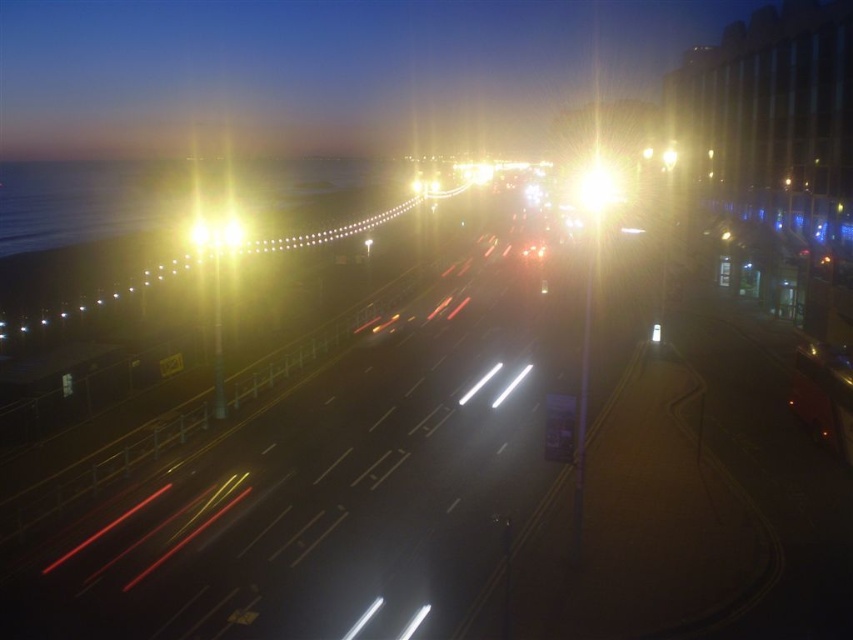
Is metallic orange car at lower right taller than bright yellow light at center?

No, metallic orange car at lower right is not taller than bright yellow light at center.

Is metallic orange car at lower right in front of bright yellow light at center?

That is True.

I want to click on metallic orange car at lower right, so click(x=822, y=394).

Does bright metallic streetlight at center have a lesser height compared to bright yellow light at center?

No, bright metallic streetlight at center is not shorter than bright yellow light at center.

Identify the location of bright metallic streetlight at center. point(596,186).

Is point (621, 198) closer to viewer compared to point (236, 248)?

No, it is not.

What are the coordinates of `bright metallic streetlight at center` in the screenshot? It's located at (596, 186).

Which is above, metallic orange car at lower right or bright metallic streetlight at center?

bright metallic streetlight at center is above.

Which of these two, metallic orange car at lower right or bright metallic streetlight at center, stands shorter?

metallic orange car at lower right

What do you see at coordinates (822, 394) in the screenshot?
I see `metallic orange car at lower right` at bounding box center [822, 394].

This screenshot has width=853, height=640. I want to click on metallic orange car at lower right, so click(822, 394).